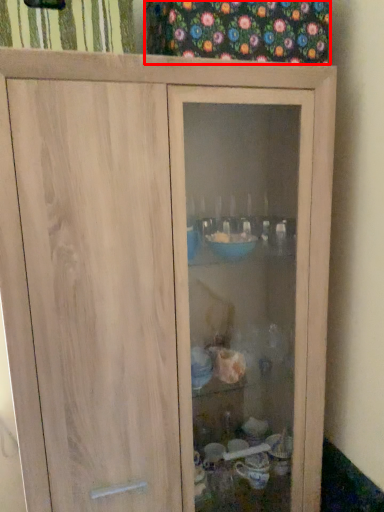
Question: From the image's perspective, where is curtain (annotated by the red box) located relative to curtain?

Choices:
 (A) below
 (B) above

Answer: (B)